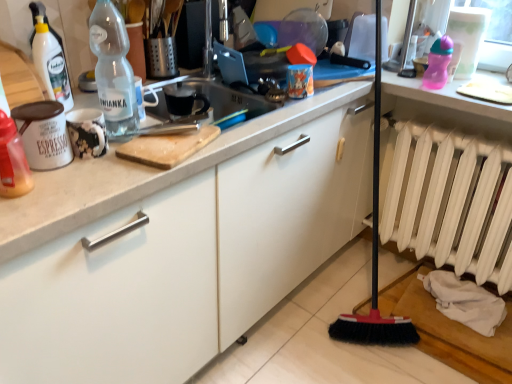
What do you see at coordinates (451, 202) in the screenshot? I see `white matte radiator at lower right` at bounding box center [451, 202].

The height and width of the screenshot is (384, 512). I want to click on transparent plastic bottle at upper left, the 1th bottle positioned from the right, so click(x=113, y=71).

Where is `white matte radiator at lower right`? This screenshot has height=384, width=512. white matte radiator at lower right is located at coordinates (451, 202).

Which is more to the right, transparent plastic bottle at upper left, marked as the 1th bottle in a back-to-front arrangement, or translucent plastic bottle at left, the first bottle when ordered from front to back?

From the viewer's perspective, transparent plastic bottle at upper left, marked as the 1th bottle in a back-to-front arrangement, appears more on the right side.

Is transparent plastic bottle at upper left, arranged as the second bottle when viewed from the left, oriented towards translucent plastic bottle at left, which is the 1th bottle from left to right?

No, transparent plastic bottle at upper left, arranged as the second bottle when viewed from the left, is not facing towards translucent plastic bottle at left, which is the 1th bottle from left to right.

Is point (89, 34) positioned in front of point (9, 189)?

No, (89, 34) is behind (9, 189).

Is transparent plastic bottle at upper left, arranged as the second bottle when viewed from the left, in front of or behind translucent plastic bottle at left, which is the 1th bottle from left to right, in the image?

Clearly, transparent plastic bottle at upper left, arranged as the second bottle when viewed from the left, is behind translucent plastic bottle at left, which is the 1th bottle from left to right.

How many degrees apart are the facing directions of translucent plastic bottle at left, which is the 1th bottle from left to right, and white matte radiator at lower right?

The facing directions of translucent plastic bottle at left, which is the 1th bottle from left to right, and white matte radiator at lower right are 84.4 degrees apart.

Which is farther from the camera, (6, 161) or (438, 235)?

The point (438, 235) is farther.

Would you say translucent plastic bottle at left, which appears as the 2th bottle when viewed from the back, is outside white matte radiator at lower right?

translucent plastic bottle at left, which appears as the 2th bottle when viewed from the back, lies outside white matte radiator at lower right's area.

From the picture: From the image's perspective, who appears lower, translucent plastic bottle at left, the first bottle ordered from the bottom, or white matte radiator at lower right?

white matte radiator at lower right is shown below in the image.

From a real-world perspective, is translucent plastic bottle at left, acting as the second bottle starting from the top, physically below transparent plastic bottle at upper left, positioned as the 2th bottle in bottom-to-top order?

Yes, from a real-world perspective, translucent plastic bottle at left, acting as the second bottle starting from the top, is beneath transparent plastic bottle at upper left, positioned as the 2th bottle in bottom-to-top order.

Looking at this image, looking at their sizes, would you say translucent plastic bottle at left, acting as the second bottle starting from the top, is wider or thinner than transparent plastic bottle at upper left, which is the 1th bottle in top-to-bottom order?

Clearly, translucent plastic bottle at left, acting as the second bottle starting from the top, has less width compared to transparent plastic bottle at upper left, which is the 1th bottle in top-to-bottom order.

How far apart are translucent plastic bottle at left, acting as the second bottle starting from the top, and transparent plastic bottle at upper left, marked as the 1th bottle in a back-to-front arrangement?

10.20 inches.

Would you say translucent plastic bottle at left, arranged as the 2th bottle when viewed from the right, is a long distance from transparent plastic bottle at upper left, marked as the 1th bottle in a back-to-front arrangement?

No, translucent plastic bottle at left, arranged as the 2th bottle when viewed from the right, is in close proximity to transparent plastic bottle at upper left, marked as the 1th bottle in a back-to-front arrangement.

From a real-world perspective, which object rests below the other?

In real-world perspective, white matte radiator at lower right is lower.

Considering the positions of point (425, 160) and point (95, 34), is point (425, 160) closer or farther from the camera than point (95, 34)?

Point (425, 160) appears to be farther away from the viewer than point (95, 34).

Would you say transparent plastic bottle at upper left, the 2th bottle positioned from the front, is part of white matte radiator at lower right's contents?

No.

Is white matte radiator at lower right shorter than transparent plastic bottle at upper left, which is the 1th bottle in top-to-bottom order?

No, white matte radiator at lower right is not shorter than transparent plastic bottle at upper left, which is the 1th bottle in top-to-bottom order.

Are transparent plastic bottle at upper left, the 1th bottle positioned from the right, and white matte radiator at lower right making contact?

No, transparent plastic bottle at upper left, the 1th bottle positioned from the right, is not making contact with white matte radiator at lower right.

How far apart are transparent plastic bottle at upper left, the 2th bottle positioned from the front, and white matte radiator at lower right?

A distance of 1.21 meters exists between transparent plastic bottle at upper left, the 2th bottle positioned from the front, and white matte radiator at lower right.

From the image's perspective, is transparent plastic bottle at upper left, the 2th bottle positioned from the front, over white matte radiator at lower right?

Yes, from the image's perspective, transparent plastic bottle at upper left, the 2th bottle positioned from the front, is on top of white matte radiator at lower right.

Which is closer, [114,135] or [437,159]?

The point [114,135] is more forward.

Could you measure the distance between white matte radiator at lower right and translucent plastic bottle at left, which is the 1th bottle from left to right?

They are 4.79 feet apart.

Is the surface of white matte radiator at lower right in direct contact with translucent plastic bottle at left, which appears as the 2th bottle when viewed from the back?

No, white matte radiator at lower right is not in contact with translucent plastic bottle at left, which appears as the 2th bottle when viewed from the back.

Find the location of a particular element. bottle that is the 1st object above the white matte radiator at lower right (from a real-world perspective) is located at coordinates (12, 161).

From a real-world perspective, which object rests below the other?

white matte radiator at lower right is physically lower.

What are the coordinates of `bottle that is on the left side of transparent plastic bottle at upper left, the 2th bottle positioned from the front` in the screenshot? It's located at (12, 161).

Where is `radiator behind the translucent plastic bottle at left, arranged as the 2th bottle when viewed from the right`? radiator behind the translucent plastic bottle at left, arranged as the 2th bottle when viewed from the right is located at coordinates (451, 202).

Estimate the real-world distances between objects in this image. Which object is closer to transparent plastic bottle at upper left, arranged as the second bottle when viewed from the left, white matte radiator at lower right or translucent plastic bottle at left, arranged as the 2th bottle when viewed from the right?

translucent plastic bottle at left, arranged as the 2th bottle when viewed from the right, is closer to transparent plastic bottle at upper left, arranged as the second bottle when viewed from the left.

Looking at the image, which one is located further to translucent plastic bottle at left, arranged as the 2th bottle when viewed from the right, transparent plastic bottle at upper left, marked as the 1th bottle in a back-to-front arrangement, or white matte radiator at lower right?

white matte radiator at lower right.

Estimate the real-world distances between objects in this image. Which object is closer to translucent plastic bottle at left, which is the 1th bottle from left to right, white matte radiator at lower right or transparent plastic bottle at upper left, marked as the 1th bottle in a back-to-front arrangement?

The object closer to translucent plastic bottle at left, which is the 1th bottle from left to right, is transparent plastic bottle at upper left, marked as the 1th bottle in a back-to-front arrangement.

Which object lies further to the anchor point white matte radiator at lower right, translucent plastic bottle at left, which appears as the 2th bottle when viewed from the back, or transparent plastic bottle at upper left, marked as the 1th bottle in a back-to-front arrangement?

translucent plastic bottle at left, which appears as the 2th bottle when viewed from the back, is positioned further to the anchor white matte radiator at lower right.

Based on their spatial positions, is transparent plastic bottle at upper left, the 1th bottle positioned from the right, or translucent plastic bottle at left, acting as the second bottle starting from the top, further from white matte radiator at lower right?

translucent plastic bottle at left, acting as the second bottle starting from the top, lies further to white matte radiator at lower right than the other object.

Which object lies nearer to the anchor point transparent plastic bottle at upper left, arranged as the second bottle when viewed from the left, translucent plastic bottle at left, which is the 1th bottle from left to right, or white matte radiator at lower right?

The object closer to transparent plastic bottle at upper left, arranged as the second bottle when viewed from the left, is translucent plastic bottle at left, which is the 1th bottle from left to right.

Where is `bottle between translucent plastic bottle at left, which is the 1th bottle from left to right, and white matte radiator at lower right from left to right`? This screenshot has width=512, height=384. bottle between translucent plastic bottle at left, which is the 1th bottle from left to right, and white matte radiator at lower right from left to right is located at coordinates (113, 71).